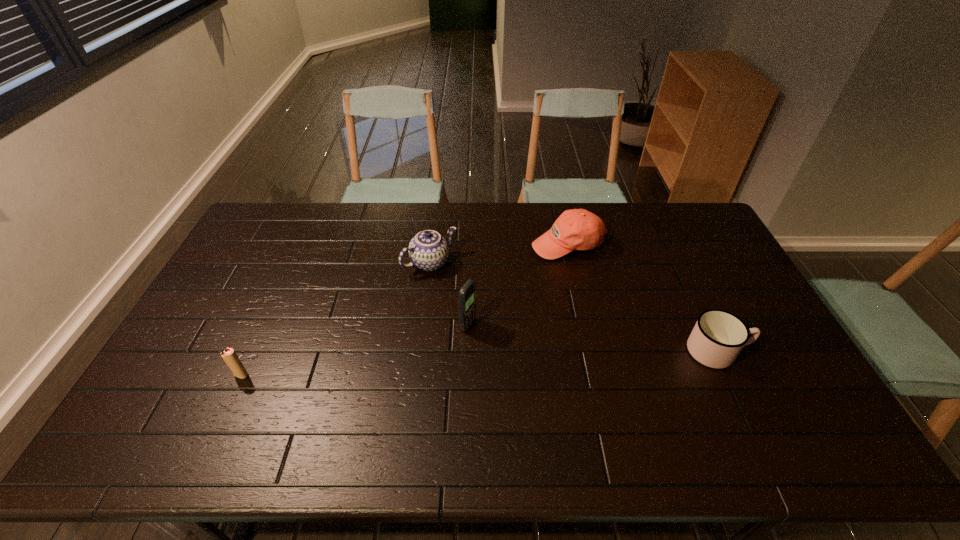
Where is `free point between the fourth object from right to left and the leftmost object`? free point between the fourth object from right to left and the leftmost object is located at coordinates (336, 319).

Identify the location of vacant area between the fourth object from right to left and the leftmost object. The width and height of the screenshot is (960, 540). (336, 319).

Image resolution: width=960 pixels, height=540 pixels. What are the coordinates of `unoccupied position between the baseball cap and the tallest object` in the screenshot? It's located at (517, 285).

The image size is (960, 540). I want to click on empty space between the tallest object and the fourth object from right to left, so click(x=449, y=294).

You are a GUI agent. You are given a task and a screenshot of the screen. Output one action in this format:
    pyautogui.click(x=<x>, y=<y>)
    Task: Click on the second closest object to the baseball cap
    
    Given the screenshot: What is the action you would take?
    (x=467, y=295)

Locate which object is the closest to the second object from right to left. Please provide its 2D coordinates. Your answer should be formatted as a tuple, i.e. [(x, y)], where the tuple contains the x and y coordinates of a point satisfying the conditions above.

[(428, 250)]

The width and height of the screenshot is (960, 540). Find the location of `free space in the image that satisfies the following two spatial constraints: 1. on the front side of the chinaware; 2. on the side of the rightmost object with the handle`. free space in the image that satisfies the following two spatial constraints: 1. on the front side of the chinaware; 2. on the side of the rightmost object with the handle is located at coordinates (420, 351).

Locate an element on the screen. The image size is (960, 540). free spot that satisfies the following two spatial constraints: 1. on the front side of the mug; 2. on the side of the second object from right to left with the handle is located at coordinates pos(590,351).

This screenshot has width=960, height=540. Find the location of `vacant space that satisfies the following two spatial constraints: 1. on the back side of the leftmost object; 2. on the right side of the cellular telephone`. vacant space that satisfies the following two spatial constraints: 1. on the back side of the leftmost object; 2. on the right side of the cellular telephone is located at coordinates (264, 326).